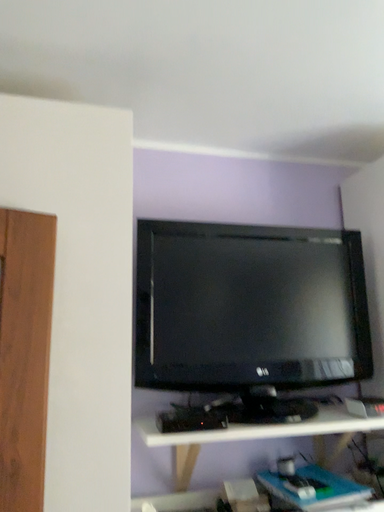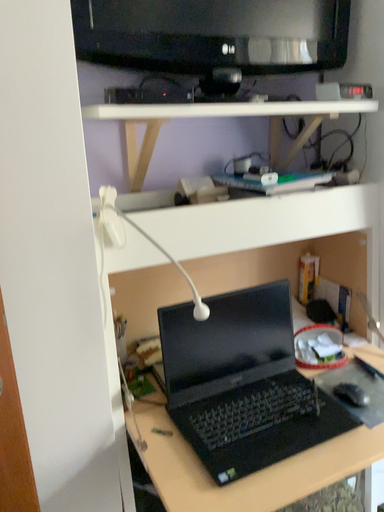
Question: Which way did the camera rotate in the video?

Choices:
 (A) rotated downward
 (B) rotated upward

Answer: (A)